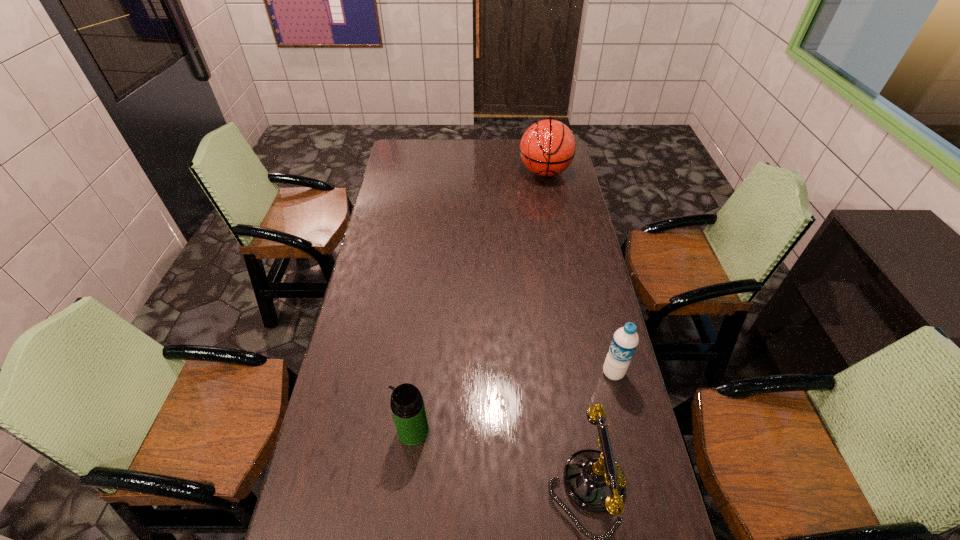
The height and width of the screenshot is (540, 960). Identify the location of vacant area that lies between the thermos bottle and the water bottle. (514, 402).

The height and width of the screenshot is (540, 960). Identify the location of vacant area that lies between the water bottle and the basketball. (579, 273).

Find the location of `vacant region between the leftmost object and the basketball`. vacant region between the leftmost object and the basketball is located at coordinates 479,302.

Locate an element on the screen. The width and height of the screenshot is (960, 540). free spot between the thermos bottle and the basketball is located at coordinates (479, 302).

Find the location of a particular element. object that can be found as the closest to the third nearest object is located at coordinates (593, 480).

The image size is (960, 540). I want to click on object that stands as the second closest to the telephone, so click(x=407, y=405).